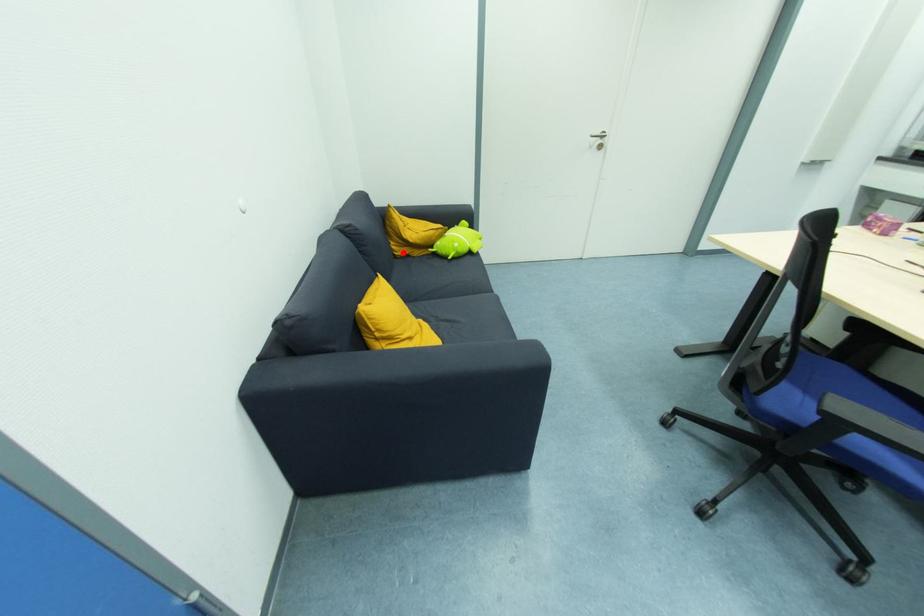
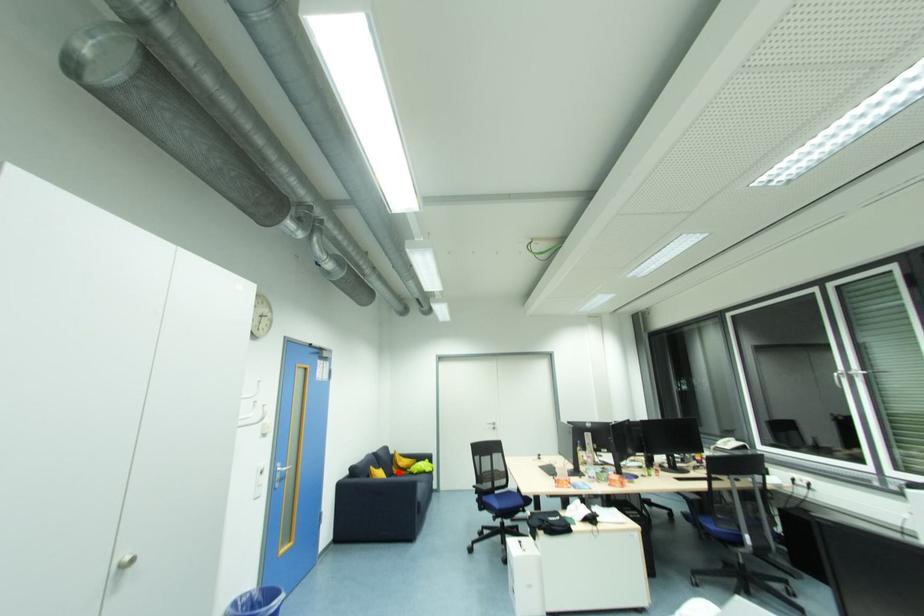
I am providing you with two images of the same scene from different viewpoints. A red point is marked on the first image and another point is marked on the second image. Do the highlighted points in image1 and image2 indicate the same real-world spot?

Yes